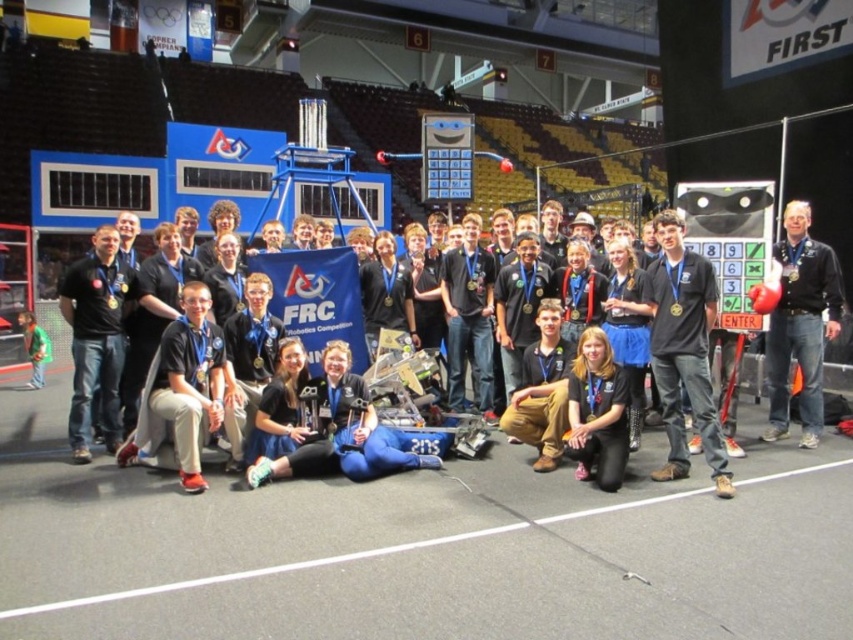
Can you confirm if black matte shirt at center is shorter than green fabric shirt at lower left?

In fact, black matte shirt at center may be taller than green fabric shirt at lower left.

How far apart are black matte shirt at center and green fabric shirt at lower left?

black matte shirt at center is 7.96 meters away from green fabric shirt at lower left.

You are a GUI agent. You are given a task and a screenshot of the screen. Output one action in this format:
    pyautogui.click(x=<x>, y=<y>)
    Task: Click on the black matte shirt at center
    
    Given the screenshot: What is the action you would take?
    pyautogui.click(x=683, y=349)

Is point (679, 387) behind point (613, 440)?

Yes, it is behind point (613, 440).

I want to click on black matte shirt at center, so click(683, 349).

Which is in front, point (695, 387) or point (585, 339)?

Point (695, 387)

Where is `black matte shirt at center`? This screenshot has width=853, height=640. black matte shirt at center is located at coordinates [x=683, y=349].

The height and width of the screenshot is (640, 853). Describe the element at coordinates (96, 339) in the screenshot. I see `matte black shirt at center` at that location.

Does matte black shirt at center have a larger size compared to black fabric shirt at center?

Yes, matte black shirt at center is bigger than black fabric shirt at center.

Does point (90, 440) come in front of point (579, 412)?

No, it is behind (579, 412).

The height and width of the screenshot is (640, 853). I want to click on matte black shirt at center, so click(x=96, y=339).